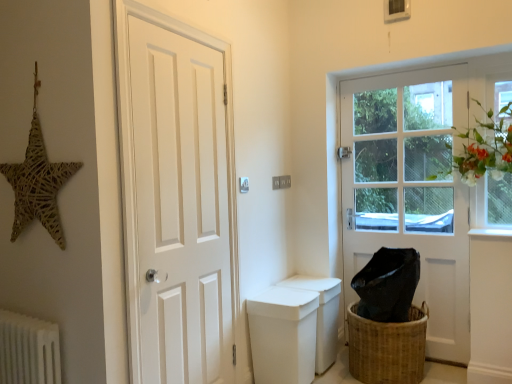
Question: From a real-world perspective, is woven brown basket at lower right on white matte toilet bowl at center?

Choices:
 (A) no
 (B) yes

Answer: (A)

Question: Considering the relative sizes of woven brown basket at lower right and white matte toilet bowl at center in the image provided, is woven brown basket at lower right smaller than white matte toilet bowl at center?

Choices:
 (A) yes
 (B) no

Answer: (B)

Question: From the image's perspective, is woven brown basket at lower right below white matte toilet bowl at center?

Choices:
 (A) no
 (B) yes

Answer: (B)

Question: Does woven brown basket at lower right have a lesser height compared to white matte toilet bowl at center?

Choices:
 (A) no
 (B) yes

Answer: (B)

Question: Is woven brown basket at lower right thinner than white matte toilet bowl at center?

Choices:
 (A) no
 (B) yes

Answer: (A)

Question: Relative to white smooth window sill at lower right, is white wooden door at right, the 1th door in the right-to-left sequence, in front or behind?

Choices:
 (A) behind
 (B) front

Answer: (A)

Question: From the image's perspective, relative to white smooth window sill at lower right, is white wooden door at right, acting as the 1th door starting from the back, above or below?

Choices:
 (A) above
 (B) below

Answer: (A)

Question: Visually, is white wooden door at right, the 2th door viewed from the left, positioned to the left or to the right of white smooth window sill at lower right?

Choices:
 (A) right
 (B) left

Answer: (B)

Question: Is point (422, 172) positioned closer to the camera than point (487, 233)?

Choices:
 (A) closer
 (B) farther

Answer: (B)

Question: Is white smooth window sill at lower right taller or shorter than white matte door at left, which is the 1th door in front-to-back order?

Choices:
 (A) tall
 (B) short

Answer: (B)

Question: Is white smooth window sill at lower right inside or outside of white matte door at left, acting as the 1th door starting from the left?

Choices:
 (A) inside
 (B) outside

Answer: (B)

Question: Is white smooth window sill at lower right bigger or smaller than white matte door at left, acting as the 1th door starting from the left?

Choices:
 (A) big
 (B) small

Answer: (B)

Question: From the image's perspective, relative to white matte door at left, acting as the 1th door starting from the left, is white smooth window sill at lower right above or below?

Choices:
 (A) below
 (B) above

Answer: (A)

Question: In terms of width, does white wooden door at right, which is counted as the second door, starting from the front, look wider or thinner when compared to clear glass window at upper right?

Choices:
 (A) wide
 (B) thin

Answer: (A)

Question: In terms of size, does white wooden door at right, which is counted as the second door, starting from the front, appear bigger or smaller than clear glass window at upper right?

Choices:
 (A) big
 (B) small

Answer: (A)